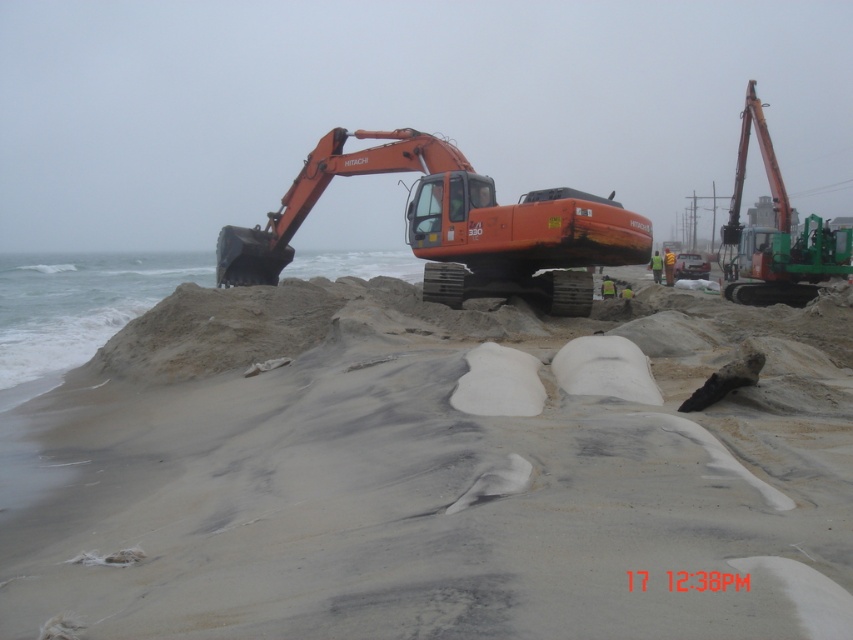
Question: Is orange metallic excavator at center bigger than orange metallic excavator at right?

Choices:
 (A) no
 (B) yes

Answer: (A)

Question: Estimate the real-world distances between objects in this image. Which object is farther from the orange metallic excavator at center?

Choices:
 (A) smooth sand at center
 (B) orange metallic excavator at right

Answer: (B)

Question: Is smooth sand at center thinner than orange metallic excavator at center?

Choices:
 (A) yes
 (B) no

Answer: (B)

Question: Which point appears closest to the camera in this image?

Choices:
 (A) (804, 611)
 (B) (289, 211)

Answer: (A)

Question: Which point is closer to the camera taking this photo?

Choices:
 (A) pos(749,580)
 (B) pos(433,266)
 (C) pos(769,301)

Answer: (A)

Question: Can you confirm if orange metallic excavator at center is positioned below orange metallic excavator at right?

Choices:
 (A) yes
 (B) no

Answer: (A)